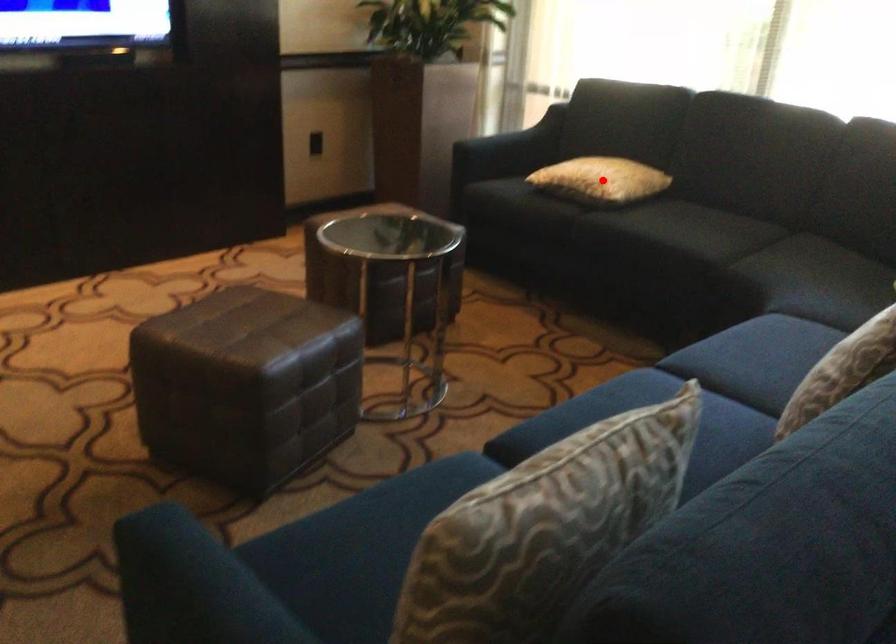
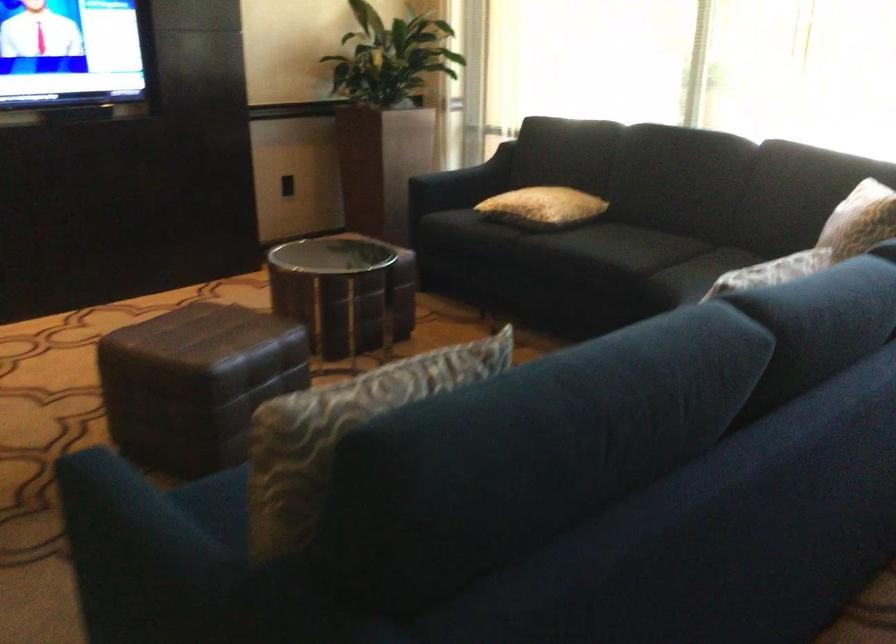
The point at the highlighted location is marked in the first image. Where is the corresponding point in the second image?

(543, 207)